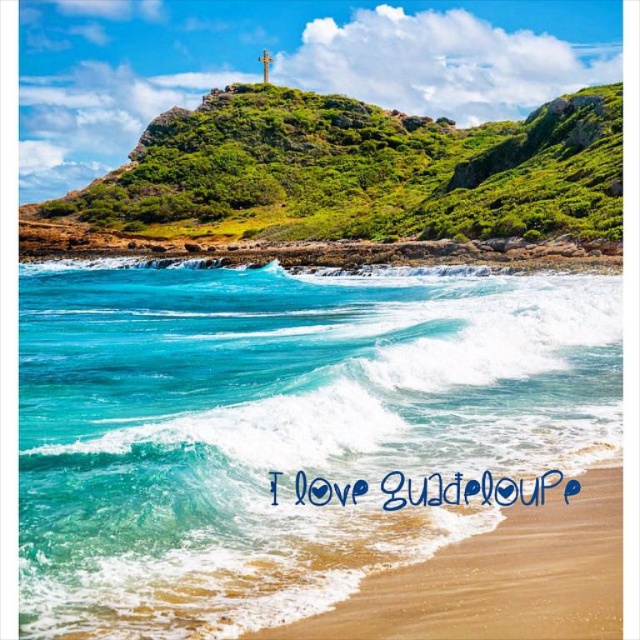
Which is behind, point (493, 288) or point (387, 211)?

Positioned behind is point (387, 211).

Which of these two, turquoise glossy water at lower left or green grassy hill at upper center, stands taller?

green grassy hill at upper center is taller.

Is point (52, 452) less distant than point (316, 96)?

That is True.

Find the location of a particular element. turquoise glossy water at lower left is located at coordinates click(x=280, y=429).

Does point (28, 492) lie behind point (342, 600)?

That is True.

Can you confirm if turquoise glossy water at lower left is positioned below sandy beach at lower right?

No.

Does point (88, 422) come closer to viewer compared to point (564, 604)?

No, (88, 422) is further to viewer.

Find the location of `turquoise glossy water at lower left`. turquoise glossy water at lower left is located at coordinates (280, 429).

Which is below, green grassy hill at upper center or sandy beach at lower right?

sandy beach at lower right is below.

Can you confirm if green grassy hill at upper center is bigger than sandy beach at lower right?

Yes, green grassy hill at upper center is bigger than sandy beach at lower right.

The height and width of the screenshot is (640, 640). I want to click on green grassy hill at upper center, so click(x=358, y=172).